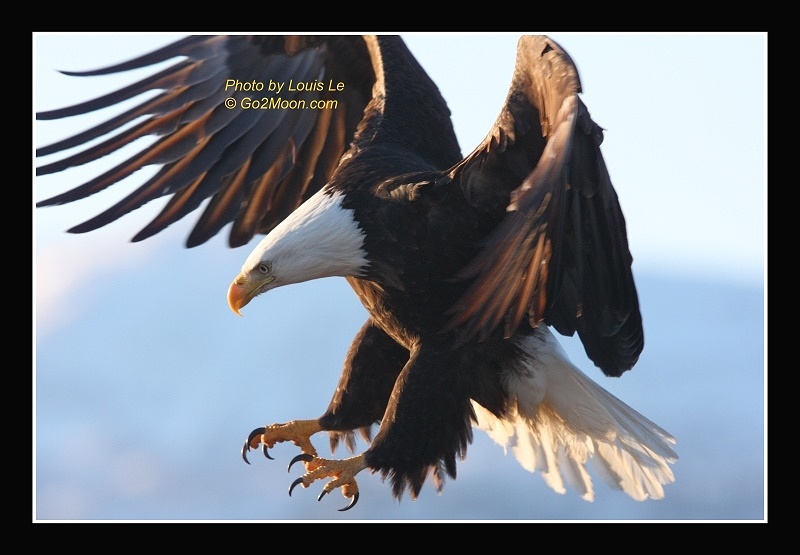
Where is `chest`? The height and width of the screenshot is (555, 800). chest is located at coordinates (377, 290).